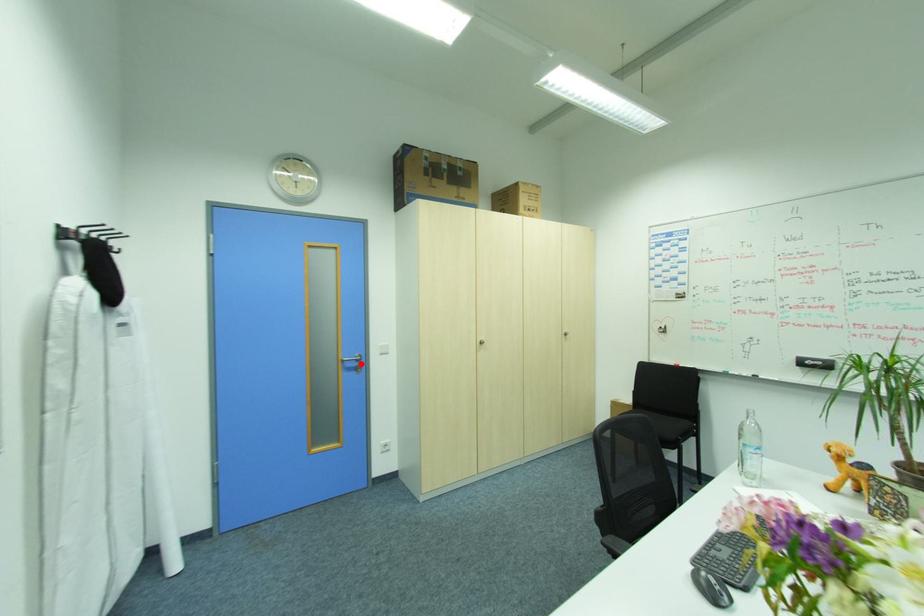
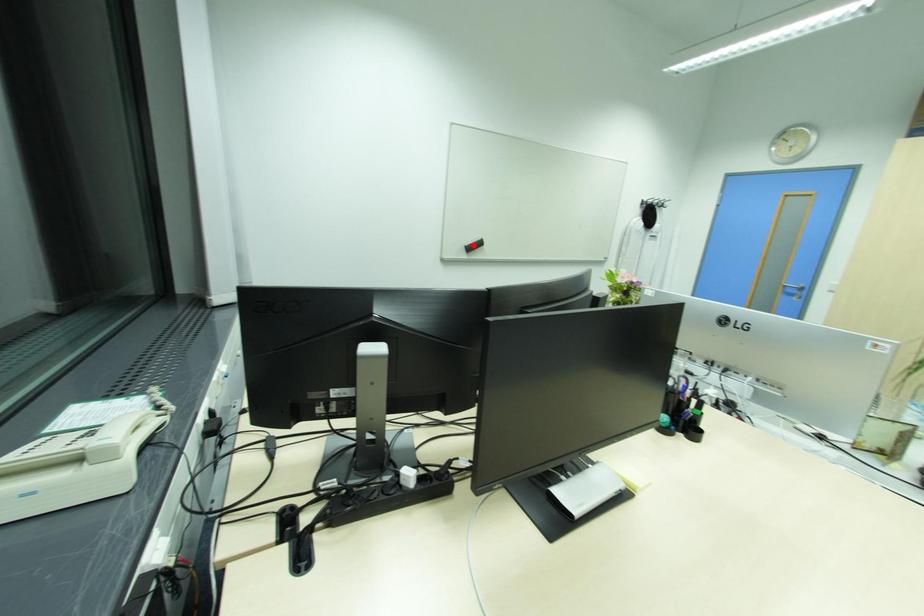
I am providing you with two images of the same scene from different viewpoints. A red point is marked on the first image and another point is marked on the second image. Is the marked point in image1 the same physical position as the marked point in image2?

No